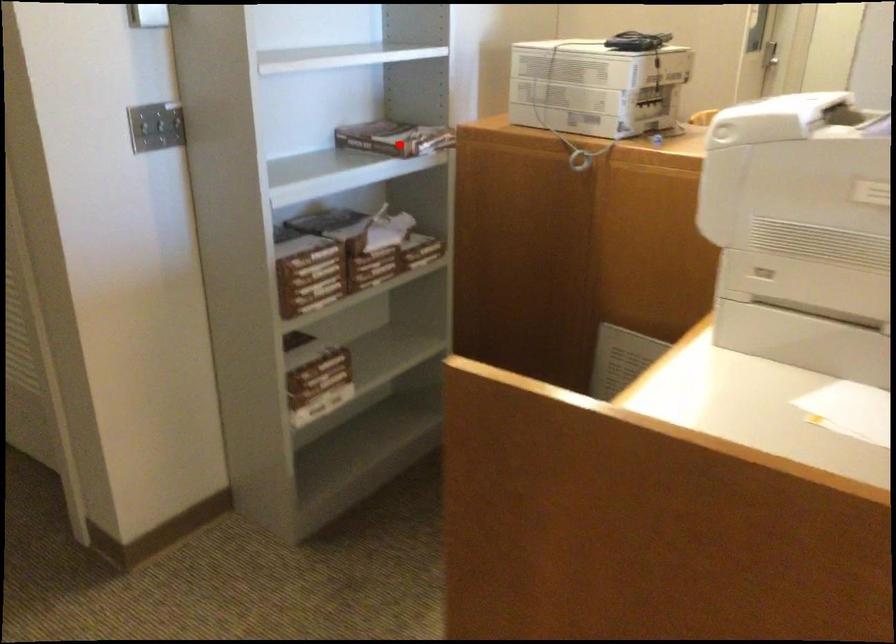
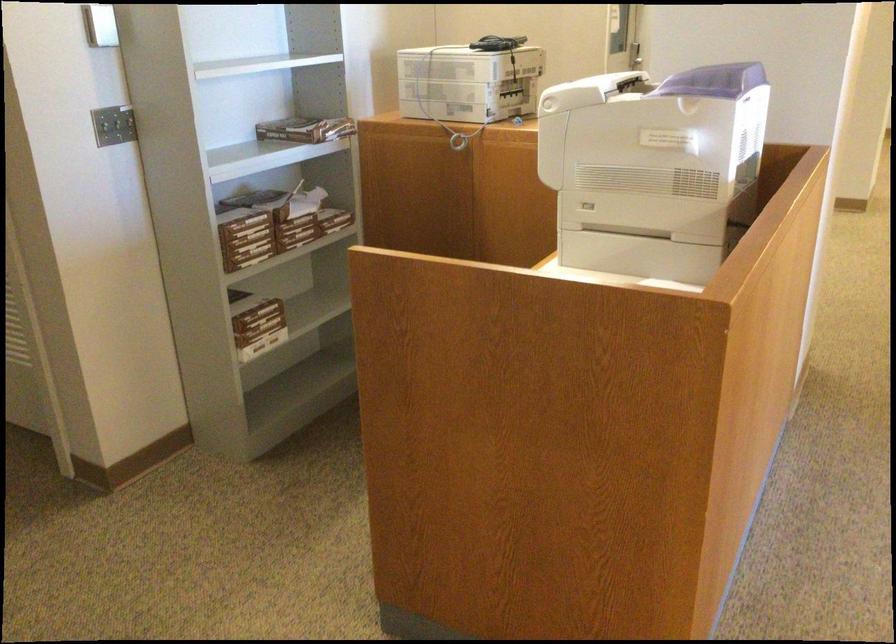
In the second image, find the point that corresponds to the highlighted location in the first image.

(306, 129)